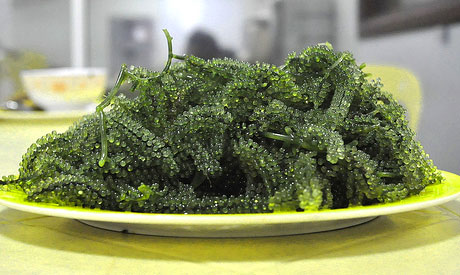
Image resolution: width=460 pixels, height=275 pixels. I want to click on empty wall space, so click(440, 95).